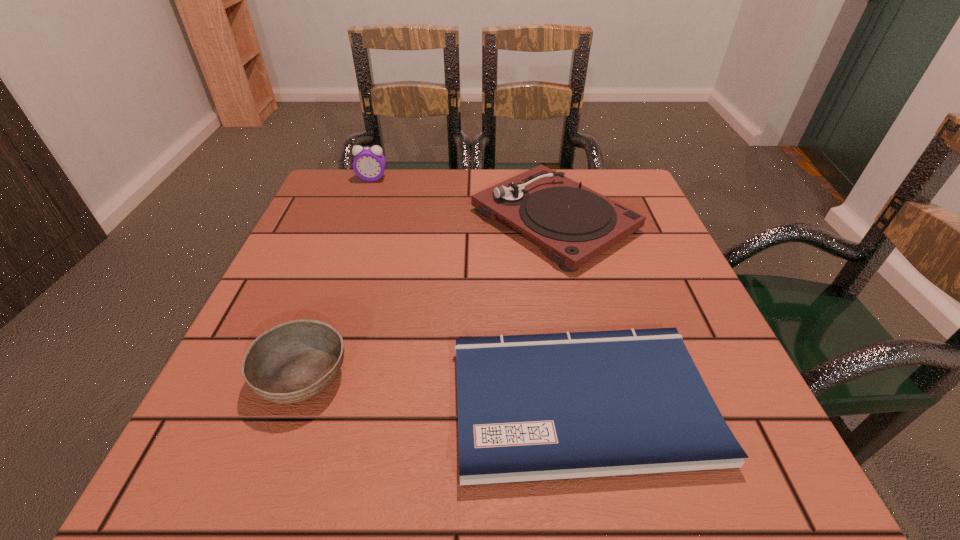
Find the location of a particular element. vacant space at the left edge is located at coordinates (270, 291).

The height and width of the screenshot is (540, 960). Find the location of `free space at the right edge of the desktop`. free space at the right edge of the desktop is located at coordinates (636, 257).

The image size is (960, 540). Find the location of `free space at the near left corner of the desktop`. free space at the near left corner of the desktop is located at coordinates (179, 490).

You are a GUI agent. You are given a task and a screenshot of the screen. Output one action in this format:
    pyautogui.click(x=<x>, y=<y>)
    Task: Click on the vacant area at the far right corner
    The width and height of the screenshot is (960, 540).
    Given the screenshot: What is the action you would take?
    pyautogui.click(x=607, y=194)

I want to click on vacant space that's between the alarm clock and the shortest object, so click(x=476, y=289).

The height and width of the screenshot is (540, 960). I want to click on empty space that is in between the second tallest object and the shortest object, so click(567, 310).

Identify the location of free space between the paperback book and the bowl. This screenshot has height=540, width=960. (442, 389).

The height and width of the screenshot is (540, 960). In order to click on empty location between the third shortest object and the tallest object in this screenshot , I will do coord(463,199).

Locate an element on the screen. Image resolution: width=960 pixels, height=540 pixels. empty space between the shortest object and the tallest object is located at coordinates [476, 289].

Locate an element on the screen. Image resolution: width=960 pixels, height=540 pixels. vacant area that lies between the alarm clock and the second shortest object is located at coordinates (338, 277).